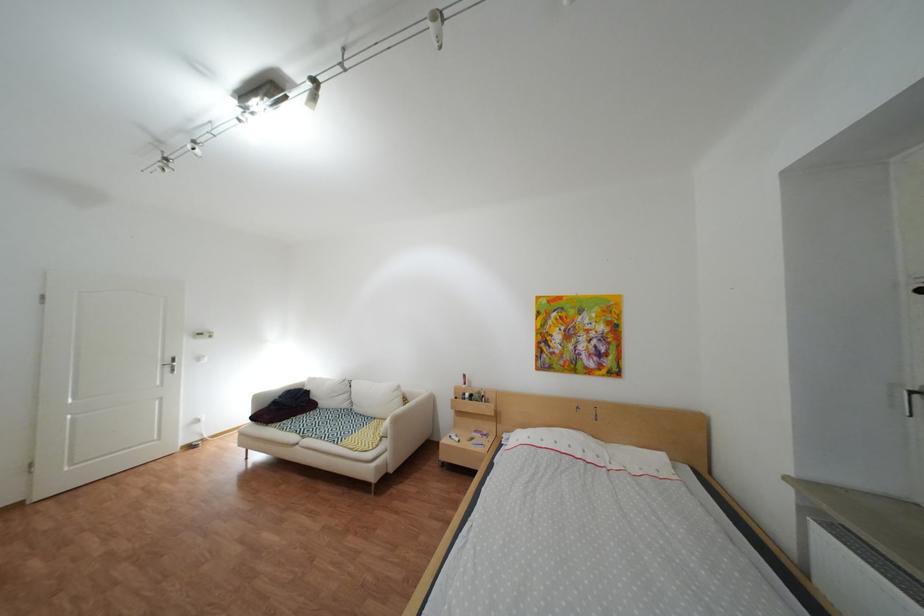
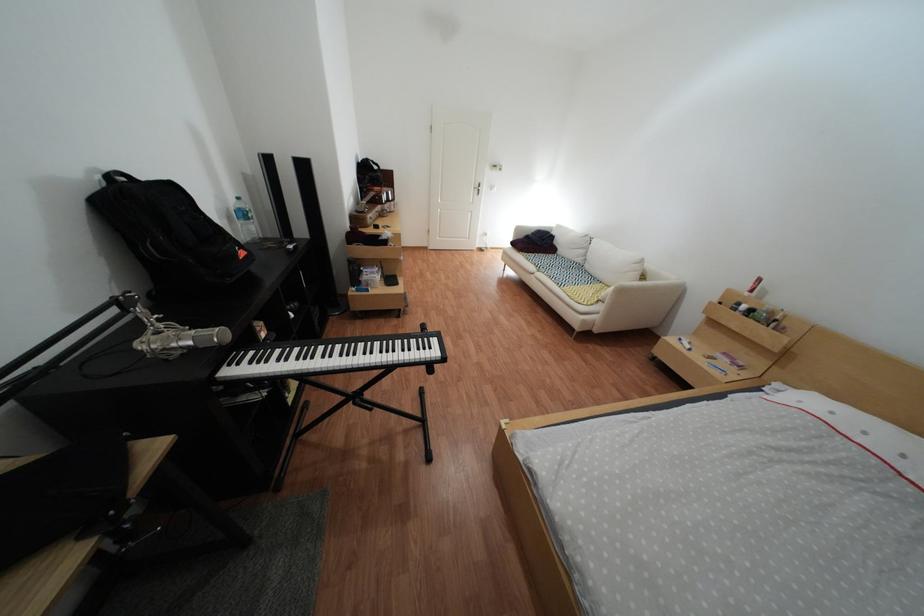
First-person continuous shooting, in which direction is the camera rotating?

The camera rotated toward left-down.